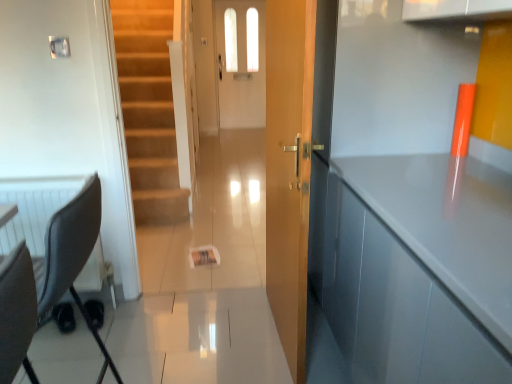
Locate an element on the screen. This screenshot has width=512, height=384. black fabric swivel chair at left is located at coordinates (72, 254).

The image size is (512, 384). I want to click on wooden door at center, so click(289, 169).

At what (x,y) coordinates should I click in order to perform the action: click on white glossy door at center. Please return your answer as a coordinate pair (x, y). This screenshot has width=512, height=384. Looking at the image, I should click on (241, 63).

The width and height of the screenshot is (512, 384). What are the coordinates of `door that is on the right side of white glossy door at center` in the screenshot? It's located at (289, 169).

Is wooden door at center not close to white glossy door at center?

Indeed, wooden door at center is not near white glossy door at center.

Is white glossy door at center inside wooden door at center?

No, white glossy door at center is located outside of wooden door at center.

Is point (274, 260) farther from viewer compared to point (260, 18)?

No, (274, 260) is in front of (260, 18).

Where is `door above the glossy gray cabinet at right (from a real-world perspective)`? The width and height of the screenshot is (512, 384). door above the glossy gray cabinet at right (from a real-world perspective) is located at coordinates (289, 169).

Does point (283, 123) lie in front of point (443, 208)?

No, (283, 123) is further to viewer.

Does wooden door at center appear on the right side of glossy gray cabinet at right?

No.

From the image's perspective, is wooden door at center on glossy gray cabinet at right?

Yes, from the image's perspective, wooden door at center is on top of glossy gray cabinet at right.

Which is correct: glossy gray cabinet at right is inside white glossy door at center, or outside of it?

glossy gray cabinet at right is not inside white glossy door at center, it's outside.

Is glossy gray cabinet at right facing away from white glossy door at center?

No, glossy gray cabinet at right's orientation is not away from white glossy door at center.

Who is taller, glossy gray cabinet at right or white glossy door at center?

Standing taller between the two is white glossy door at center.

Can you confirm if glossy gray cabinet at right is bigger than white glossy door at center?

Correct, glossy gray cabinet at right is larger in size than white glossy door at center.

From the picture: Are white glossy door at center and wooden door at center making contact?

No, white glossy door at center is not beside wooden door at center.

Which object is closer to the camera taking this photo, white glossy door at center or wooden door at center?

Positioned in front is wooden door at center.

From the image's perspective, is white glossy door at center under wooden door at center?

Actually, white glossy door at center appears above wooden door at center in the image.

Can you tell me how much white glossy door at center and wooden door at center differ in facing direction?

white glossy door at center and wooden door at center are facing 85.8 degrees away from each other.

Is black fabric swivel chair at left turned away from glossy gray cabinet at right?

Yes, black fabric swivel chair at left is positioned with its back facing glossy gray cabinet at right.

From the image's perspective, is black fabric swivel chair at left above glossy gray cabinet at right?

Yes, from the image's perspective, black fabric swivel chair at left is over glossy gray cabinet at right.

Locate an element on the screen. This screenshot has width=512, height=384. swivel chair on the left of glossy gray cabinet at right is located at coordinates (72, 254).

Does black fabric swivel chair at left appear on the right side of glossy gray cabinet at right?

Incorrect, black fabric swivel chair at left is not on the right side of glossy gray cabinet at right.

Is glossy gray cabinet at right looking in the opposite direction of wooden door at center?

No, glossy gray cabinet at right is not facing away from wooden door at center.

Which of these two, glossy gray cabinet at right or wooden door at center, is bigger?

With larger size is glossy gray cabinet at right.

Looking at this image, which is in front, glossy gray cabinet at right or wooden door at center?

glossy gray cabinet at right is closer to the camera.

Between black fabric swivel chair at left and wooden door at center, which one has smaller width?

wooden door at center.

Can you confirm if black fabric swivel chair at left is shorter than wooden door at center?

Yes, black fabric swivel chair at left is shorter than wooden door at center.

From a real-world perspective, is black fabric swivel chair at left positioned over wooden door at center based on gravity?

Incorrect, from a real-world perspective, black fabric swivel chair at left is lower than wooden door at center.

From the image's perspective, is black fabric swivel chair at left under wooden door at center?

Yes, from the image's perspective, black fabric swivel chair at left is beneath wooden door at center.

Locate an element on the screen. Image resolution: width=512 pixels, height=384 pixels. door below the white glossy door at center (from a real-world perspective) is located at coordinates (289, 169).

At what (x,y) coordinates should I click in order to perform the action: click on door behind the glossy gray cabinet at right. Please return your answer as a coordinate pair (x, y). Image resolution: width=512 pixels, height=384 pixels. Looking at the image, I should click on (289, 169).

Which object lies nearer to the anchor point white glossy door at center, glossy gray cabinet at right or wooden door at center?

The object closer to white glossy door at center is wooden door at center.

Looking at the image, which one is located closer to wooden door at center, glossy gray cabinet at right or black fabric swivel chair at left?

The object closer to wooden door at center is glossy gray cabinet at right.

Considering their positions, is glossy gray cabinet at right positioned closer to wooden door at center than white glossy door at center?

glossy gray cabinet at right is closer to wooden door at center.

When comparing their distances from black fabric swivel chair at left, does white glossy door at center or glossy gray cabinet at right seem further?

Based on the image, white glossy door at center appears to be further to black fabric swivel chair at left.

Estimate the real-world distances between objects in this image. Which object is closer to glossy gray cabinet at right, white glossy door at center or black fabric swivel chair at left?

black fabric swivel chair at left is positioned closer to the anchor glossy gray cabinet at right.

Based on their spatial positions, is white glossy door at center or black fabric swivel chair at left further from wooden door at center?

The object further to wooden door at center is white glossy door at center.

Looking at the image, which one is located further to black fabric swivel chair at left, wooden door at center or white glossy door at center?

The object further to black fabric swivel chair at left is white glossy door at center.

When comparing their distances from glossy gray cabinet at right, does wooden door at center or white glossy door at center seem closer?

wooden door at center is closer to glossy gray cabinet at right.

The width and height of the screenshot is (512, 384). Identify the location of door located between glossy gray cabinet at right and white glossy door at center in the depth direction. (289, 169).

Where is `swivel chair positioned between glossy gray cabinet at right and white glossy door at center from near to far`? The height and width of the screenshot is (384, 512). swivel chair positioned between glossy gray cabinet at right and white glossy door at center from near to far is located at coordinates (72, 254).

Where is `door between black fabric swivel chair at left and glossy gray cabinet at right from left to right`? The image size is (512, 384). door between black fabric swivel chair at left and glossy gray cabinet at right from left to right is located at coordinates (289, 169).

The width and height of the screenshot is (512, 384). Find the location of `door between black fabric swivel chair at left and white glossy door at center in the front-back direction`. door between black fabric swivel chair at left and white glossy door at center in the front-back direction is located at coordinates (289, 169).